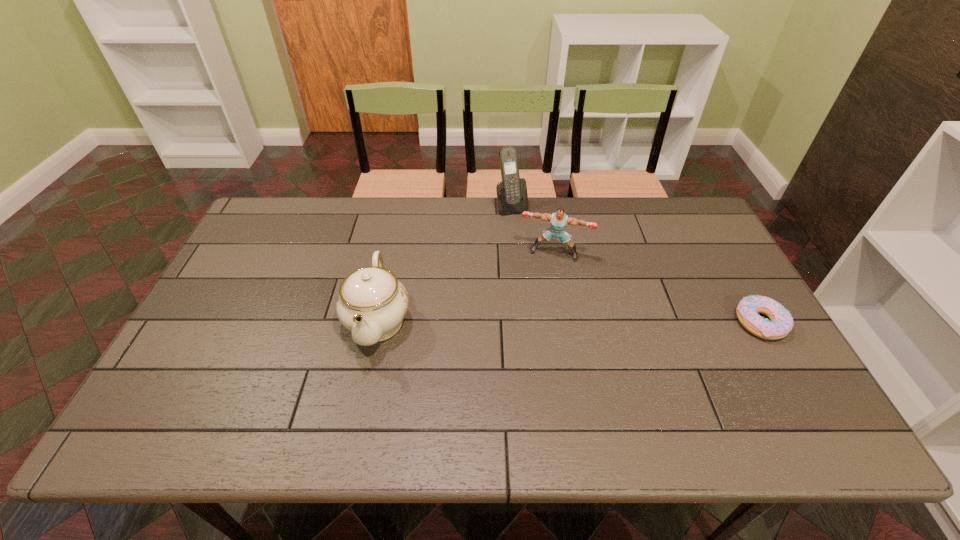
Locate an element on the screen. vacant spot on the desktop that is between the leftmost object and the doughnut and is positioned on the front-facing side of the second farthest object is located at coordinates (538, 321).

Image resolution: width=960 pixels, height=540 pixels. Find the location of `vacant space on the desktop that is between the leftmost object and the shortest object and is positioned on the front-facing side of the farthest object`. vacant space on the desktop that is between the leftmost object and the shortest object and is positioned on the front-facing side of the farthest object is located at coordinates (581, 322).